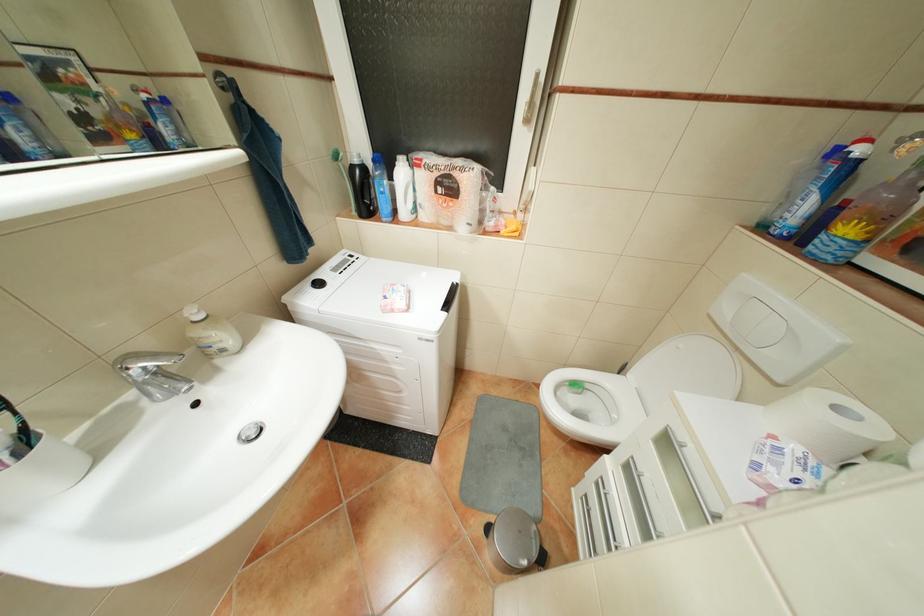
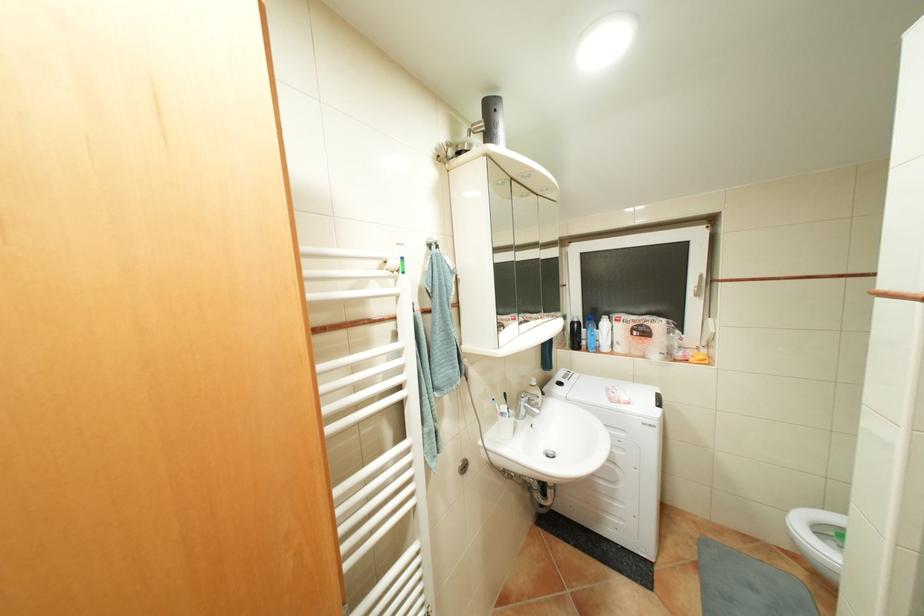
The point at (363, 213) is marked in the first image. Where is the corresponding point in the second image?

(578, 346)